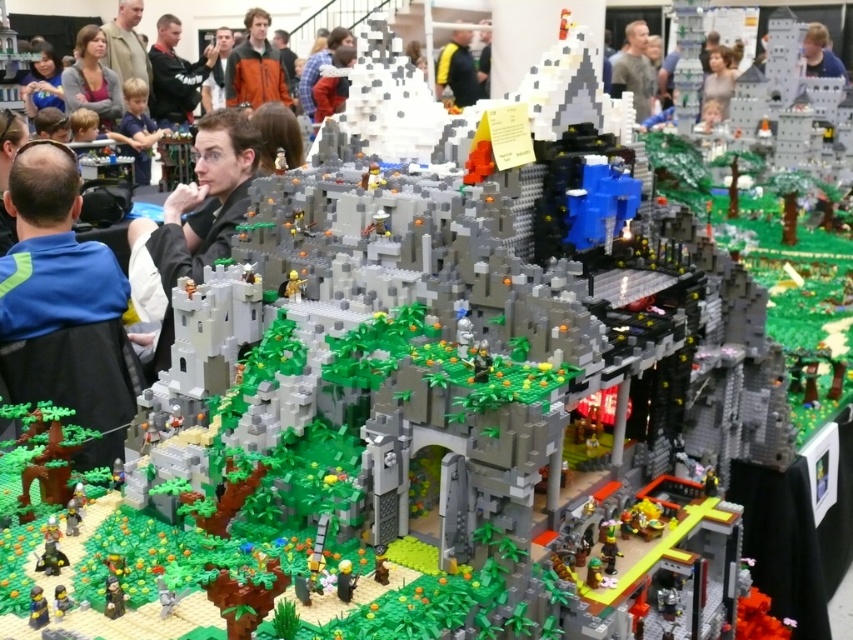
Is point (10, 269) more distant than point (248, 35)?

No, (10, 269) is closer to viewer.

Which is behind, point (33, 317) or point (268, 22)?

The point (268, 22) is behind.

The image size is (853, 640). What are the coordinates of `blue fabric shirt at left` in the screenshot? It's located at (62, 307).

Is orange fabric jacket at upper center to the left of light brown hair at upper right from the viewer's perspective?

Correct, you'll find orange fabric jacket at upper center to the left of light brown hair at upper right.

Does orange fabric jacket at upper center appear on the right side of light brown hair at upper right?

In fact, orange fabric jacket at upper center is to the left of light brown hair at upper right.

Does point (252, 67) come in front of point (834, 60)?

No, (252, 67) is behind (834, 60).

Locate an element on the screen. orange fabric jacket at upper center is located at coordinates (254, 67).

Does black matte jacket at center have a lesser height compared to light brown hair at upper right?

Incorrect, black matte jacket at center's height does not fall short of light brown hair at upper right's.

Who is positioned more to the right, black matte jacket at center or light brown hair at upper right?

light brown hair at upper right is more to the right.

Locate an element on the screen. This screenshot has height=640, width=853. black matte jacket at center is located at coordinates (202, 209).